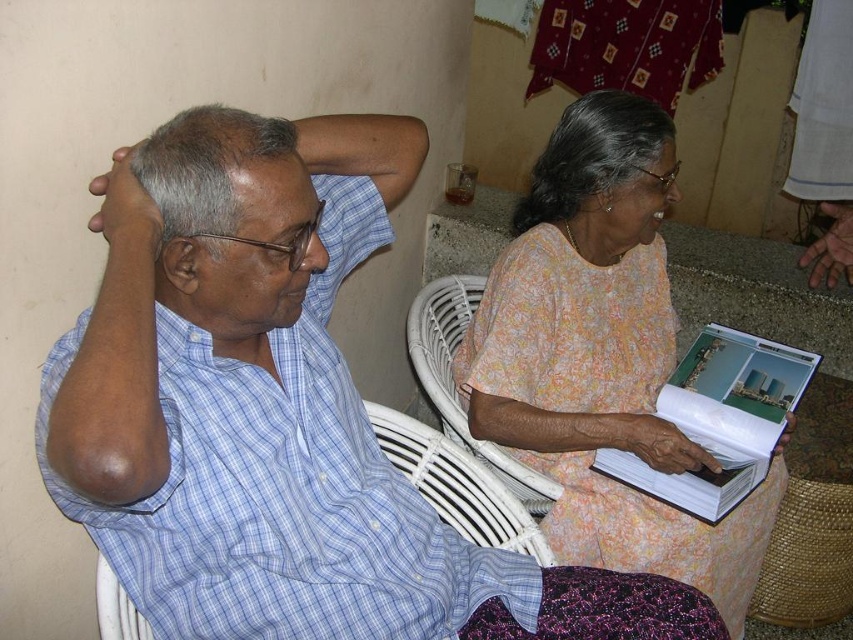
Question: Is floral fabric head at upper right below matte blue shirt at upper left?

Choices:
 (A) yes
 (B) no

Answer: (B)

Question: Is floral fabric dress at center below floral fabric head at upper right?

Choices:
 (A) yes
 (B) no

Answer: (A)

Question: Estimate the real-world distances between objects in this image. Which object is closer to the floral fabric dress at center?

Choices:
 (A) blue plaid shirt at left
 (B) floral fabric head at upper right

Answer: (B)

Question: Estimate the real-world distances between objects in this image. Which object is farther from the matte blue shirt at left?

Choices:
 (A) floral fabric dress at center
 (B) blue plaid shirt at left
 (C) floral fabric head at upper right
 (D) matte blue shirt at upper left

Answer: (C)

Question: Can you confirm if blue plaid shirt at left is smaller than matte blue shirt at upper left?

Choices:
 (A) yes
 (B) no

Answer: (B)

Question: Among these points, which one is farthest from the camera?

Choices:
 (A) (289, 204)
 (B) (71, 404)
 (C) (653, 125)

Answer: (C)